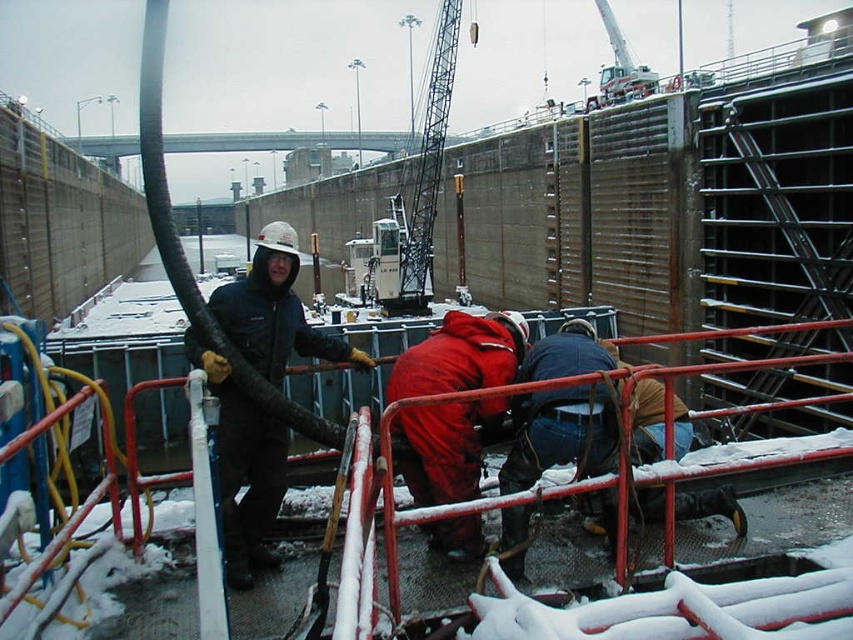
How distant is red matte jumpsuit at center from white metal crane at center?

A distance of 25.26 meters exists between red matte jumpsuit at center and white metal crane at center.

This screenshot has width=853, height=640. Identify the location of red matte jumpsuit at center. (460, 355).

You are a GUI agent. You are given a task and a screenshot of the screen. Output one action in this format:
    pyautogui.click(x=<x>, y=<y>)
    Task: Click on the red matte jumpsuit at center
    
    Given the screenshot: What is the action you would take?
    pyautogui.click(x=460, y=355)